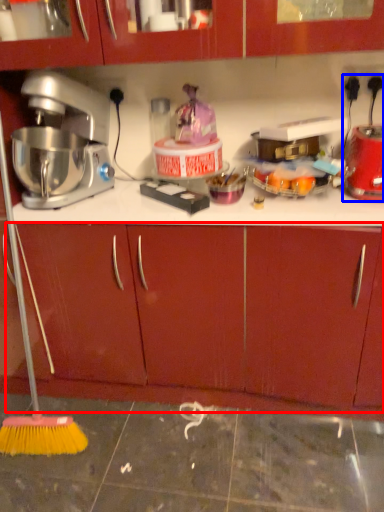
Question: Which of the following is the closest to the observer, drawer (highlighted by a red box) or blender (highlighted by a blue box)?

Choices:
 (A) drawer
 (B) blender

Answer: (A)